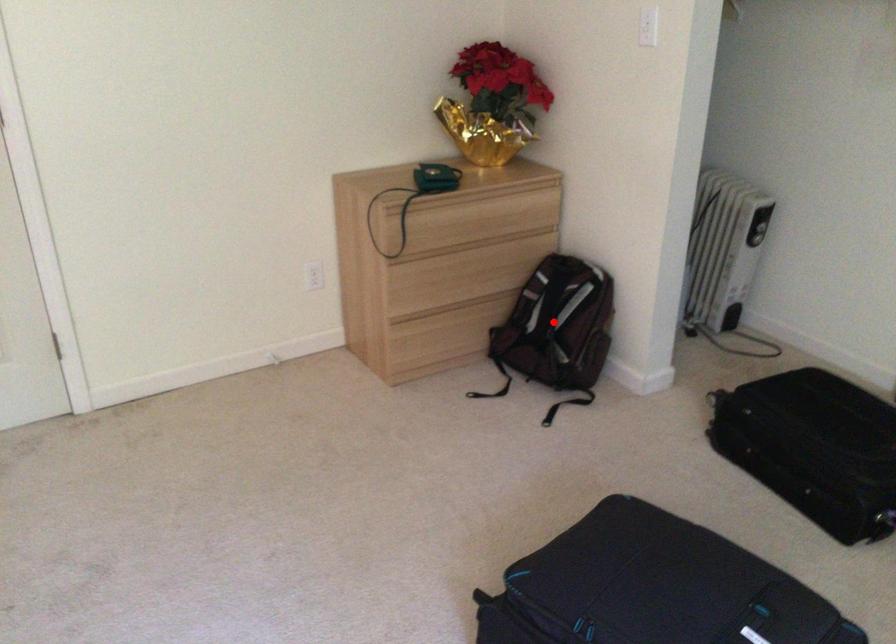
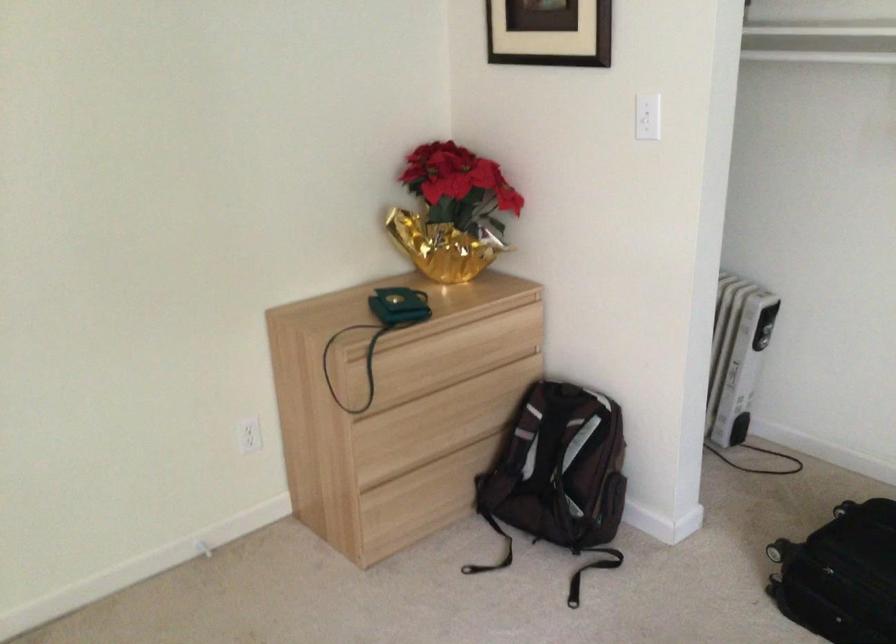
Locate, in the second image, the point that corresponds to the highlighted location in the first image.

(558, 468)